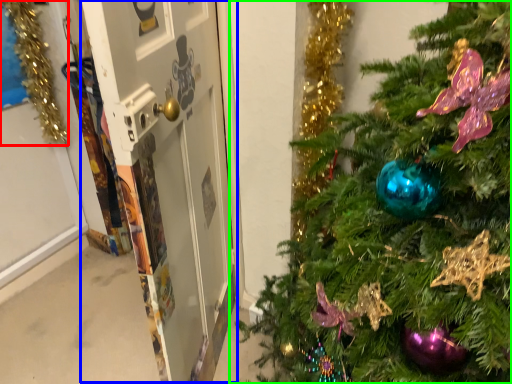
Question: Considering the real-world distances, which object is closest to christmas decoration (highlighted by a red box)? screen door (highlighted by a blue box) or christmas tree (highlighted by a green box).

Choices:
 (A) screen door
 (B) christmas tree

Answer: (A)